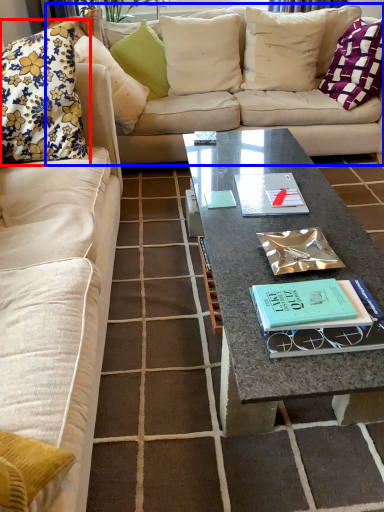
Question: Which point is closer to the camera, pillow (highlighted by a red box) or studio couch (highlighted by a blue box)?

Choices:
 (A) pillow
 (B) studio couch

Answer: (A)